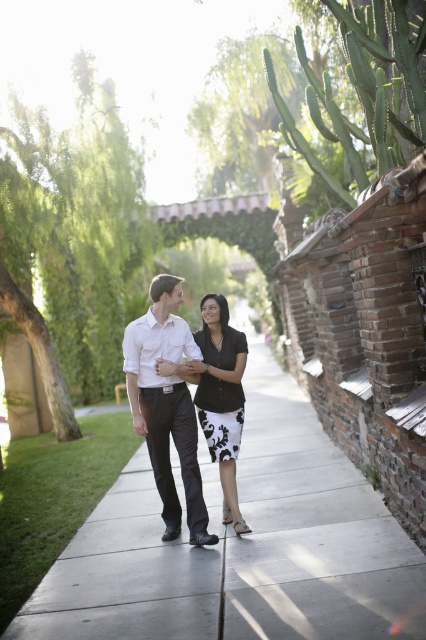
The image size is (426, 640). Describe the element at coordinates (241, 545) in the screenshot. I see `smooth concrete sidewalk at center` at that location.

Is smooth concrete sidewalk at center to the left of black matte dress at center from the viewer's perspective?

In fact, smooth concrete sidewalk at center is to the right of black matte dress at center.

The height and width of the screenshot is (640, 426). What do you see at coordinates (241, 545) in the screenshot?
I see `smooth concrete sidewalk at center` at bounding box center [241, 545].

Where is `smooth concrete sidewalk at center`? The height and width of the screenshot is (640, 426). smooth concrete sidewalk at center is located at coordinates (241, 545).

In the scene shown: Who is higher up, white satin shirt at center or black textured dress at center?

black textured dress at center

Is point (178, 296) closer to viewer compared to point (213, 420)?

Yes, it is in front of point (213, 420).

Identify the location of white satin shirt at center. (166, 404).

Does point (412, 556) lie behind point (204, 353)?

No, it is in front of (204, 353).

Measure the distance from smooth concrete sidewalk at center to black textured dress at center.

1.46 meters

Is point (189, 618) positioned in front of point (222, 349)?

That is True.

In order to click on smooth concrete sidewalk at center in this screenshot , I will do `click(241, 545)`.